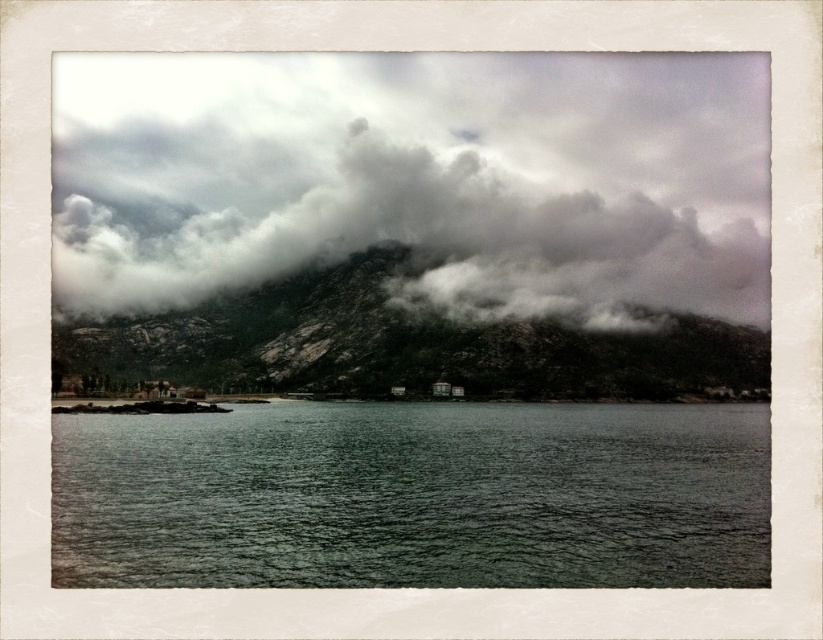
Question: Is cloudy gray sky at upper center above rocky gray mountain at center?

Choices:
 (A) yes
 (B) no

Answer: (A)

Question: Which object is the closest to the dark gray water at center?

Choices:
 (A) rocky gray mountain at center
 (B) cloudy gray sky at upper center

Answer: (A)

Question: Which object appears closest to the camera in this image?

Choices:
 (A) dark gray water at center
 (B) cloudy gray sky at upper center

Answer: (A)

Question: Does cloudy gray sky at upper center have a lesser width compared to rocky gray mountain at center?

Choices:
 (A) no
 (B) yes

Answer: (A)

Question: Which of the following is the farthest from the observer?

Choices:
 (A) (360, 582)
 (B) (322, 346)

Answer: (B)

Question: Does cloudy gray sky at upper center appear over dark gray water at center?

Choices:
 (A) no
 (B) yes

Answer: (B)